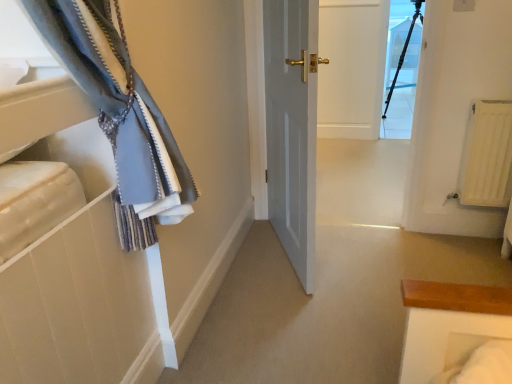
Question: Is point (418, 13) closer or farther from the camera than point (479, 130)?

Choices:
 (A) farther
 (B) closer

Answer: (A)

Question: Looking at their shapes, would you say transparent glass tripod at upper center is wider or thinner than white matte radiator at right?

Choices:
 (A) wide
 (B) thin

Answer: (B)

Question: In the image, is transparent glass tripod at upper center on the left side or the right side of white matte radiator at right?

Choices:
 (A) left
 (B) right

Answer: (B)

Question: Considering the positions of point (505, 104) and point (417, 51), is point (505, 104) closer or farther from the camera than point (417, 51)?

Choices:
 (A) farther
 (B) closer

Answer: (B)

Question: Is white matte radiator at right in front of or behind transparent glass tripod at upper center in the image?

Choices:
 (A) behind
 (B) front

Answer: (B)

Question: From the image's perspective, is white matte radiator at right above or below transparent glass tripod at upper center?

Choices:
 (A) below
 (B) above

Answer: (A)

Question: Is white matte radiator at right wider or thinner than transparent glass tripod at upper center?

Choices:
 (A) wide
 (B) thin

Answer: (A)